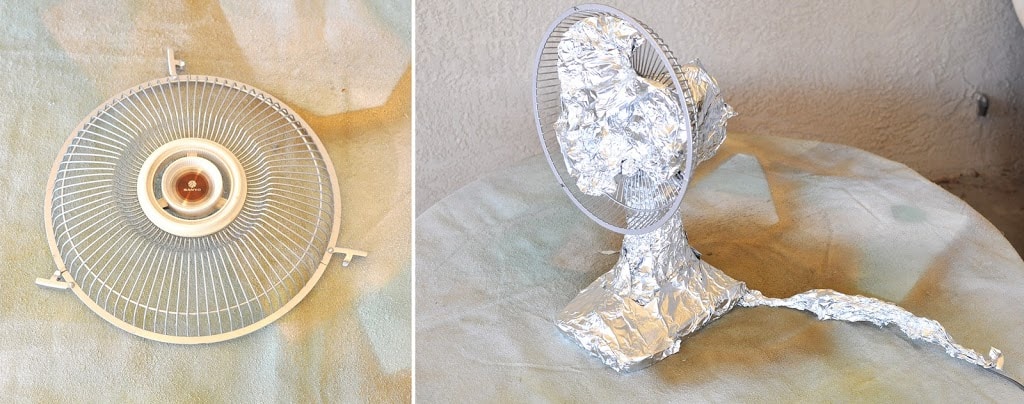
The height and width of the screenshot is (404, 1024). What are the coordinates of `brown center of fan` in the screenshot? It's located at (184, 187).